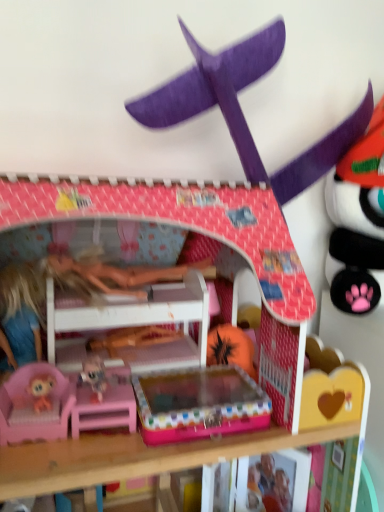
Describe the element at coordinates (241, 110) in the screenshot. I see `purple cardboard airplane at upper center` at that location.

I want to click on purple cardboard airplane at upper center, so click(241, 110).

Where is `pink plastic bunk bed at center`? pink plastic bunk bed at center is located at coordinates (176, 252).

Measure the distance between point (292, 287) and camera.

Point (292, 287) and camera are 20.59 inches apart from each other.

This screenshot has width=384, height=512. Describe the element at coordinates (176, 252) in the screenshot. I see `pink plastic bunk bed at center` at that location.

Where is `purple cardboard airplane at upper center`? The image size is (384, 512). purple cardboard airplane at upper center is located at coordinates (241, 110).

Is pink plastic bunk bed at center to the right of purple cardboard airplane at upper center from the viewer's perspective?

In fact, pink plastic bunk bed at center is to the left of purple cardboard airplane at upper center.

Is pink plastic bunk bed at center further to the viewer compared to purple cardboard airplane at upper center?

No, it is in front of purple cardboard airplane at upper center.

Considering the positions of points (212, 248) and (219, 78), is point (212, 248) closer to camera compared to point (219, 78)?

That is False.

From the image's perspective, is pink plastic bunk bed at center over purple cardboard airplane at upper center?

Actually, pink plastic bunk bed at center appears below purple cardboard airplane at upper center in the image.

From a real-world perspective, which object stands above the other?

purple cardboard airplane at upper center, from a real-world perspective.

Does pink plastic bunk bed at center have a greater width compared to purple cardboard airplane at upper center?

Indeed, pink plastic bunk bed at center has a greater width compared to purple cardboard airplane at upper center.

Looking at this image, considering the sizes of pink plastic bunk bed at center and purple cardboard airplane at upper center in the image, is pink plastic bunk bed at center taller or shorter than purple cardboard airplane at upper center?

Considering their sizes, pink plastic bunk bed at center has more height than purple cardboard airplane at upper center.

In terms of size, does pink plastic bunk bed at center appear bigger or smaller than purple cardboard airplane at upper center?

Considering their sizes, pink plastic bunk bed at center takes up more space than purple cardboard airplane at upper center.

Can purple cardboard airplane at upper center be found inside pink plastic bunk bed at center?

Yes, purple cardboard airplane at upper center is inside pink plastic bunk bed at center.

Is pink plastic bunk bed at center in contact with purple cardboard airplane at upper center?

No, pink plastic bunk bed at center is not beside purple cardboard airplane at upper center.

Is pink plastic bunk bed at center looking in the opposite direction of purple cardboard airplane at upper center?

No, pink plastic bunk bed at center is not facing the opposite direction of purple cardboard airplane at upper center.

At what (x,y) coordinates should I click in order to perform the action: click on toy lying behind the pink plastic bunk bed at center. Please return your answer as a coordinate pair (x, y). The width and height of the screenshot is (384, 512). Looking at the image, I should click on tap(241, 110).

Which object is positioned more to the left, purple cardboard airplane at upper center or pink plastic bunk bed at center?

From the viewer's perspective, pink plastic bunk bed at center appears more on the left side.

Is purple cardboard airplane at upper center positioned before pink plastic bunk bed at center?

No, purple cardboard airplane at upper center is behind pink plastic bunk bed at center.

Does point (184, 36) come farther from viewer compared to point (239, 210)?

Yes, it is behind point (239, 210).

From the image's perspective, between purple cardboard airplane at upper center and pink plastic bunk bed at center, which one is located above?

purple cardboard airplane at upper center is shown above in the image.

From a real-world perspective, which is physically below, purple cardboard airplane at upper center or pink plastic bunk bed at center?

pink plastic bunk bed at center.

Which object is wider, purple cardboard airplane at upper center or pink plastic bunk bed at center?

pink plastic bunk bed at center is wider.

Is purple cardboard airplane at upper center taller than pink plastic bunk bed at center?

No.

Which of these two, purple cardboard airplane at upper center or pink plastic bunk bed at center, is bigger?

Bigger between the two is pink plastic bunk bed at center.

Is pink plastic bunk bed at center a part of purple cardboard airplane at upper center?

Actually, pink plastic bunk bed at center is outside purple cardboard airplane at upper center.

Is the surface of purple cardboard airplane at upper center in direct contact with pink plastic bunk bed at center?

No, purple cardboard airplane at upper center is not making contact with pink plastic bunk bed at center.

Is purple cardboard airplane at upper center oriented away from pink plastic bunk bed at center?

No, purple cardboard airplane at upper center is not facing the opposite direction of pink plastic bunk bed at center.

How many degrees apart are the facing directions of purple cardboard airplane at upper center and pink plastic bunk bed at center?

The angular difference between purple cardboard airplane at upper center and pink plastic bunk bed at center is 1.58 degrees.

At what (x,y) coordinates should I click in order to perform the action: click on toy behind the pink plastic bunk bed at center. Please return your answer as a coordinate pair (x, y). Looking at the image, I should click on (241, 110).

Find the location of a particular element. bunk bed below the purple cardboard airplane at upper center (from the image's perspective) is located at coordinates (176, 252).

The width and height of the screenshot is (384, 512). In order to click on bunk bed on the left of purple cardboard airplane at upper center in this screenshot , I will do `click(176, 252)`.